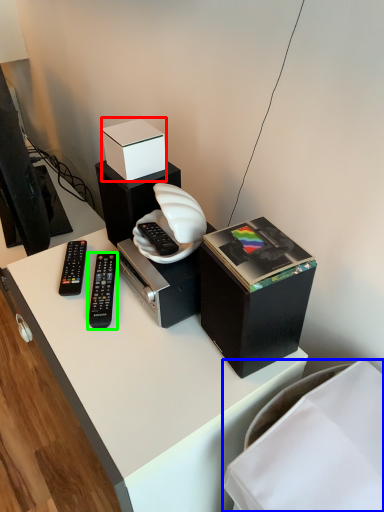
Question: Considering the real-world distances, which object is closest to box (highlighted by a red box)? furniture (highlighted by a blue box) or remote control (highlighted by a green box).

Choices:
 (A) furniture
 (B) remote control

Answer: (B)